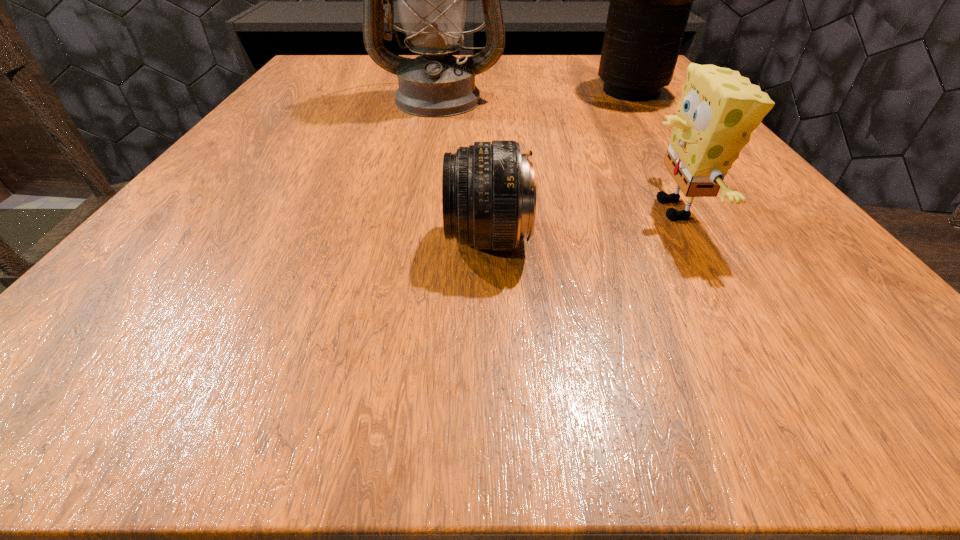
Locate an element on the screen. This screenshot has height=540, width=960. free space located 0.160m on the face of the sponge is located at coordinates (528, 210).

Locate an element on the screen. The width and height of the screenshot is (960, 540). free location located 0.250m at the front element of the nearer telephoto lens is located at coordinates (251, 240).

What are the coordinates of `vacant space located at the front element of the nearer telephoto lens` in the screenshot? It's located at (361, 240).

I want to click on vacant area situated at the front element of the nearer telephoto lens, so click(x=393, y=240).

The image size is (960, 540). Find the location of `oil lamp located in the far edge section of the desktop`. oil lamp located in the far edge section of the desktop is located at coordinates (432, 0).

This screenshot has width=960, height=540. I want to click on telephoto lens located at the far edge, so click(650, 0).

Where is `telephoto lens situated at the right edge`? The width and height of the screenshot is (960, 540). telephoto lens situated at the right edge is located at coordinates (650, 0).

The image size is (960, 540). What are the coordinates of `sponge that is at the right edge` in the screenshot? It's located at (719, 109).

You are a GUI agent. You are given a task and a screenshot of the screen. Output one action in this format:
    pyautogui.click(x=<x>, y=<y>)
    Task: Click on the object located in the far right corner section of the desktop
    
    Given the screenshot: What is the action you would take?
    pyautogui.click(x=650, y=0)

You are a GUI agent. You are given a task and a screenshot of the screen. Output one action in this format:
    pyautogui.click(x=<x>, y=<y>)
    Task: Click on the free space at the far edge of the desktop
    This screenshot has width=960, height=540.
    Given the screenshot: What is the action you would take?
    pyautogui.click(x=565, y=81)